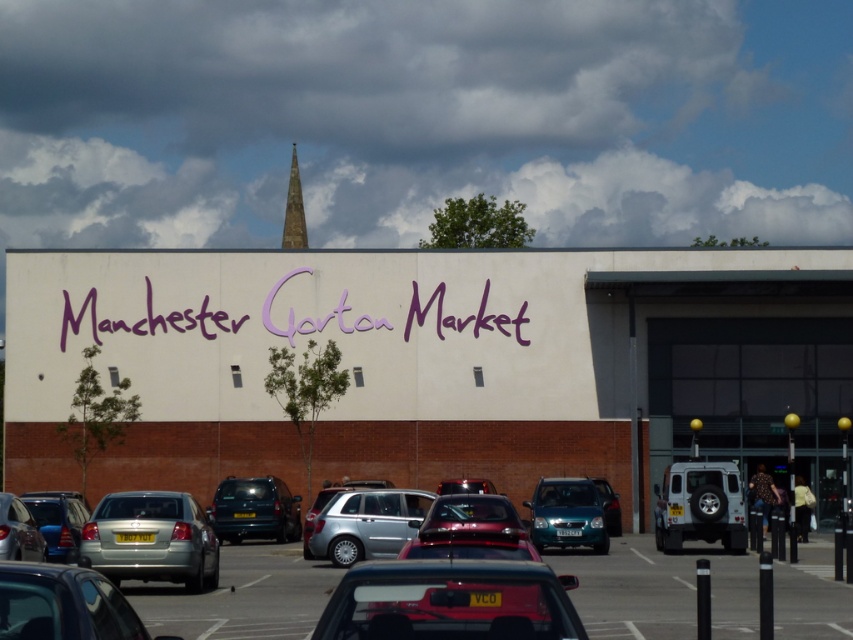
Between silver metallic sedan at center and silver metallic suv at lower right, which one has less height?

With less height is silver metallic sedan at center.

Who is more forward, (206,586) or (738,500)?

Point (206,586) is more forward.

Is point (183, 579) positioned in front of point (686, 476)?

Yes, point (183, 579) is in front of point (686, 476).

This screenshot has width=853, height=640. I want to click on silver metallic sedan at center, so click(151, 540).

Measure the distance from purple painted sign at center to silver metallic car at lower left.

The distance of purple painted sign at center from silver metallic car at lower left is 46.03 meters.

Does point (135, 323) lie behind point (82, 586)?

Yes.

At what (x,y) coordinates should I click in order to perform the action: click on purple painted sign at center. Please return your answer as a coordinate pair (x, y). This screenshot has height=640, width=853. Looking at the image, I should click on (144, 317).

Does shiny silver car at lower left have a lesser height compared to smooth gold spire at upper center?

Indeed, shiny silver car at lower left has a lesser height compared to smooth gold spire at upper center.

At what (x,y) coordinates should I click in order to perform the action: click on shiny silver car at lower left. Please return your answer as a coordinate pair (x, y). Looking at the image, I should click on (18, 531).

Locate an element on the screen. The height and width of the screenshot is (640, 853). shiny silver car at lower left is located at coordinates (18, 531).